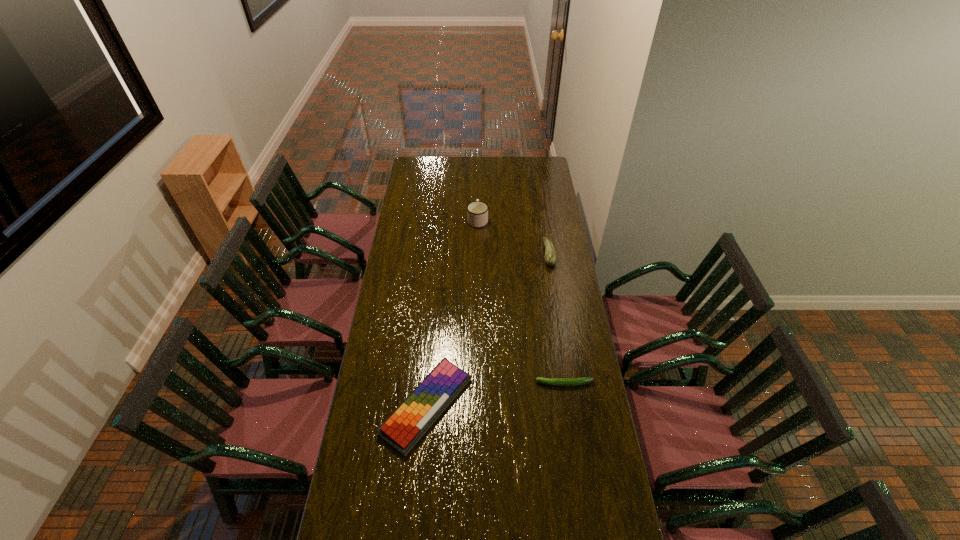
Find the location of a particular element. The height and width of the screenshot is (540, 960). vacant space located 0.130m at the stem end of the second tallest object is located at coordinates (517, 253).

Where is `free space located at the stem end of the second tallest object`? The image size is (960, 540). free space located at the stem end of the second tallest object is located at coordinates (494, 253).

I want to click on vacant space located 0.360m at the stem end of the second tallest object, so click(x=473, y=253).

Where is `vacant space positioned on the front of the third tallest object`? This screenshot has width=960, height=540. vacant space positioned on the front of the third tallest object is located at coordinates (417, 516).

This screenshot has height=540, width=960. Identify the location of free region located on the front-facing side of the nearer zucchini. (448, 383).

This screenshot has width=960, height=540. I want to click on vacant space situated 0.340m on the front-facing side of the nearer zucchini, so click(450, 383).

The image size is (960, 540). In order to click on vacant region located on the front-facing side of the nearer zucchini in this screenshot , I will do 455,383.

Locate an element on the screen. Image resolution: width=960 pixels, height=540 pixels. object at the left edge is located at coordinates (407, 424).

The width and height of the screenshot is (960, 540). I want to click on vacant space at the left edge of the desktop, so (376, 460).

Locate an element on the screen. vacant space at the right edge of the desktop is located at coordinates (556, 295).